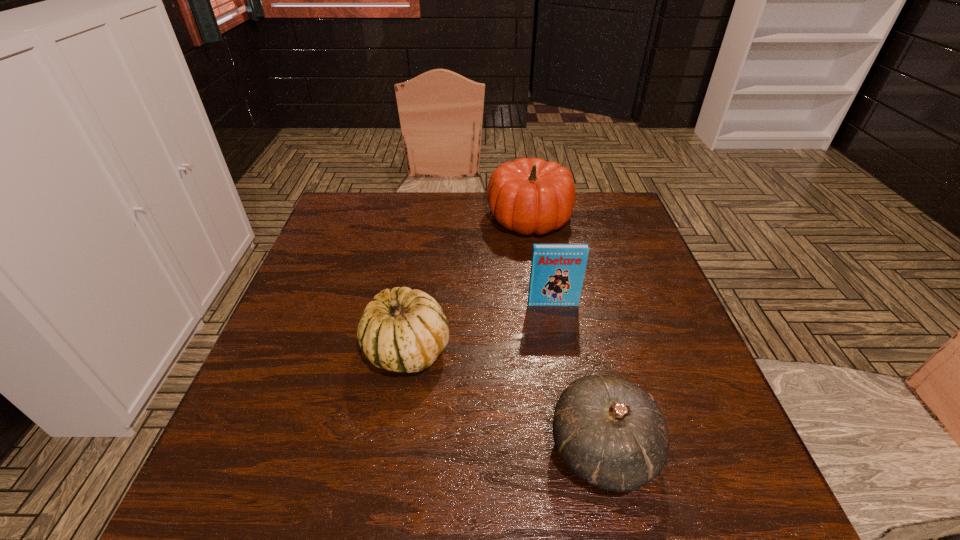
Identify the location of free spot between the nearer gourd and the farther gourd. (505, 400).

Where is `vacant space in between the third nearest object and the left gourd`? vacant space in between the third nearest object and the left gourd is located at coordinates (480, 327).

Identify the location of unoccupied area between the right gourd and the farthest object. (566, 333).

The width and height of the screenshot is (960, 540). Identify the location of empty location between the farther gourd and the farthest object. 468,284.

Image resolution: width=960 pixels, height=540 pixels. In order to click on vacant region between the left gourd and the pumpkin in this screenshot , I will do `click(468, 284)`.

Image resolution: width=960 pixels, height=540 pixels. What are the coordinates of `vacant area that lies between the nearest object and the book` in the screenshot? It's located at (578, 377).

Locate an element on the screen. vacant area that lies between the left gourd and the third nearest object is located at coordinates (480, 327).

Where is `vacant point located between the third nearest object and the third farthest object`? The image size is (960, 540). vacant point located between the third nearest object and the third farthest object is located at coordinates (480, 327).

In order to click on vacant point located between the book and the farther gourd in this screenshot , I will do `click(480, 327)`.

Identify the location of the closest object to the right gourd. (402, 330).